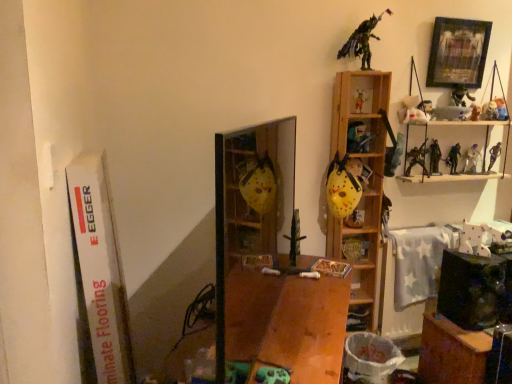
Locate an element on the screen. free area in between transparent plastic cabinet at center, acting as the third cabinet starting from the back, and wooden book at center is located at coordinates [314, 308].